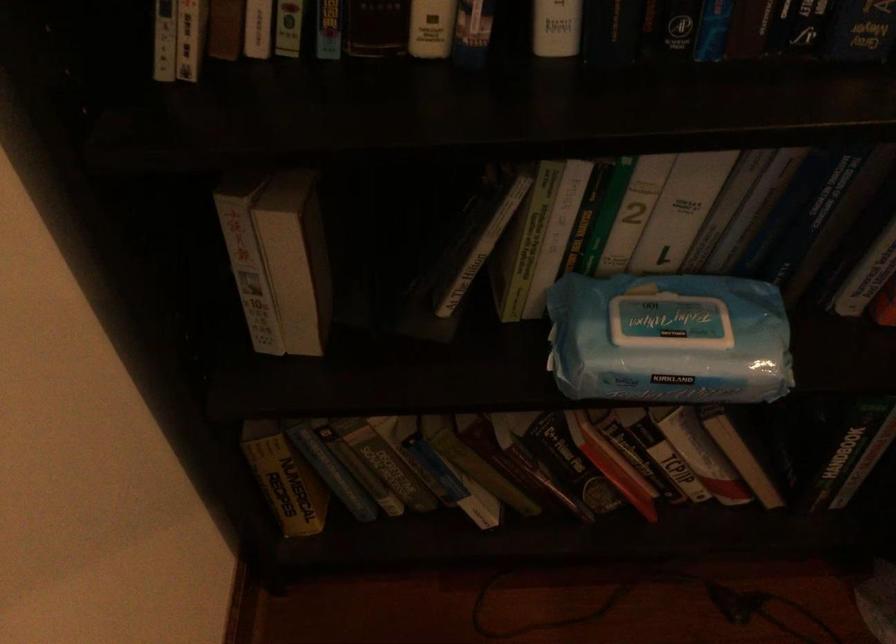
Where would you lift the white spine book? Please return your answer as a coordinate pair (x, y).

(296, 259)